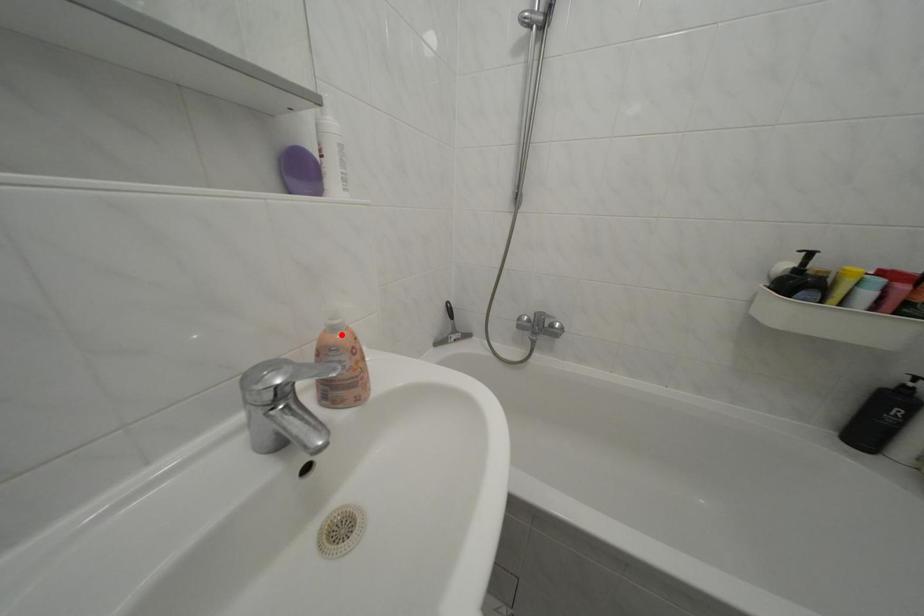
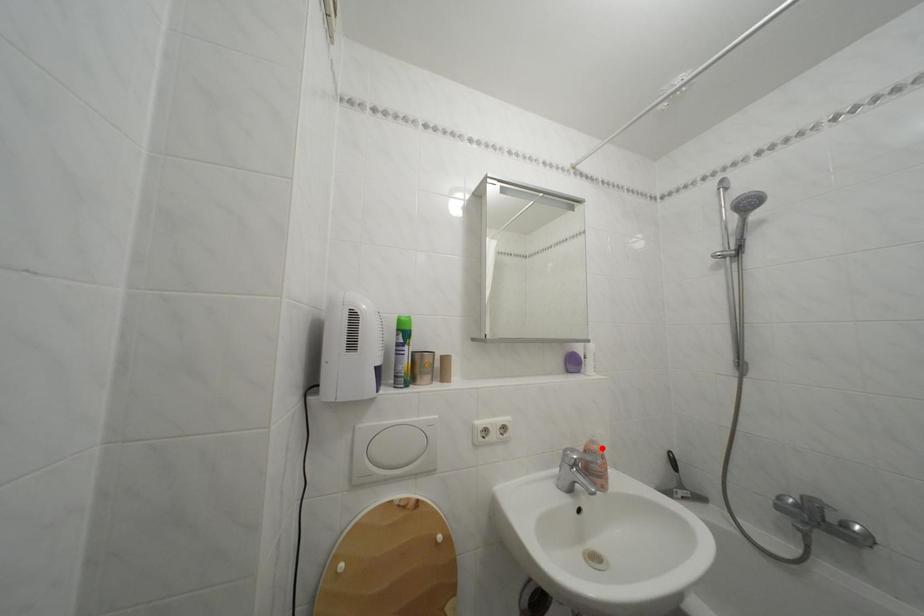
I am providing you with two images of the same scene from different viewpoints. A red point is marked on the first image and another point is marked on the second image. Are the points marked in image1 and image2 representing the same 3D position?

Yes